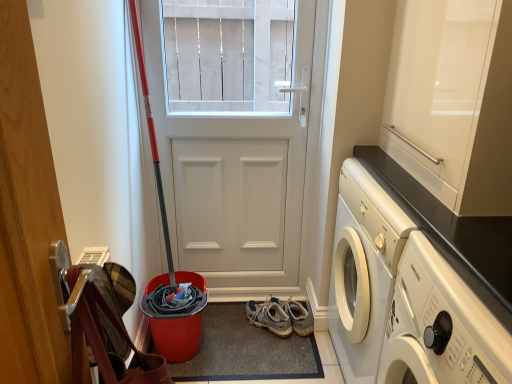
Question: Would you consider glossy white cabinet at upper right to be distant from gray suede sneakers at lower center?

Choices:
 (A) yes
 (B) no

Answer: (A)

Question: Is glossy white cabinet at upper right aimed at gray suede sneakers at lower center?

Choices:
 (A) no
 (B) yes

Answer: (A)

Question: Are glossy white cabinet at upper right and gray suede sneakers at lower center making contact?

Choices:
 (A) no
 (B) yes

Answer: (A)

Question: From the image's perspective, does glossy white cabinet at upper right appear lower than gray suede sneakers at lower center?

Choices:
 (A) yes
 (B) no

Answer: (B)

Question: Considering the relative positions of glossy white cabinet at upper right and gray suede sneakers at lower center in the image provided, is glossy white cabinet at upper right to the right of gray suede sneakers at lower center from the viewer's perspective?

Choices:
 (A) no
 (B) yes

Answer: (B)

Question: Is point (480, 334) positioned closer to the camera than point (509, 261)?

Choices:
 (A) closer
 (B) farther

Answer: (A)

Question: In the image, is white glossy washing machine at lower right on the left side or the right side of black granite countertop at upper right?

Choices:
 (A) right
 (B) left

Answer: (B)

Question: Is white glossy washing machine at lower right taller or shorter than black granite countertop at upper right?

Choices:
 (A) tall
 (B) short

Answer: (B)

Question: From a real-world perspective, is white glossy washing machine at lower right above or below black granite countertop at upper right?

Choices:
 (A) above
 (B) below

Answer: (A)

Question: From a real-world perspective, is white matte door at center physically located above or below white glossy washing machine at lower right?

Choices:
 (A) above
 (B) below

Answer: (A)

Question: Is white matte door at center inside the boundaries of white glossy washing machine at lower right, or outside?

Choices:
 (A) inside
 (B) outside

Answer: (B)

Question: Is white matte door at center wider or thinner than white glossy washing machine at lower right?

Choices:
 (A) wide
 (B) thin

Answer: (B)

Question: In terms of height, does white matte door at center look taller or shorter compared to white glossy washing machine at lower right?

Choices:
 (A) short
 (B) tall

Answer: (B)

Question: From a real-world perspective, relative to glossy white cabinet at upper right, is white glossy washing machine at lower right vertically above or below?

Choices:
 (A) above
 (B) below

Answer: (B)

Question: Is white glossy washing machine at lower right wider or thinner than glossy white cabinet at upper right?

Choices:
 (A) thin
 (B) wide

Answer: (A)